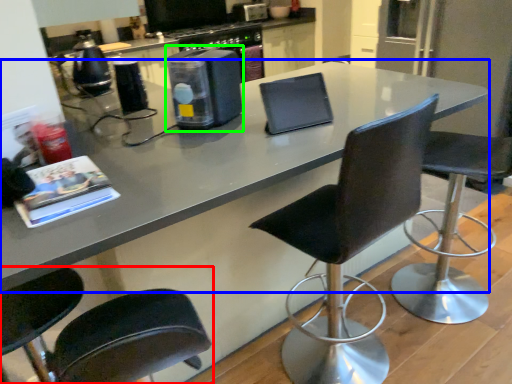
Question: Estimate the real-world distances between objects in this image. Which object is closer to chair (highlighted by a red box), countertop (highlighted by a blue box) or appliance (highlighted by a green box)?

Choices:
 (A) countertop
 (B) appliance

Answer: (A)